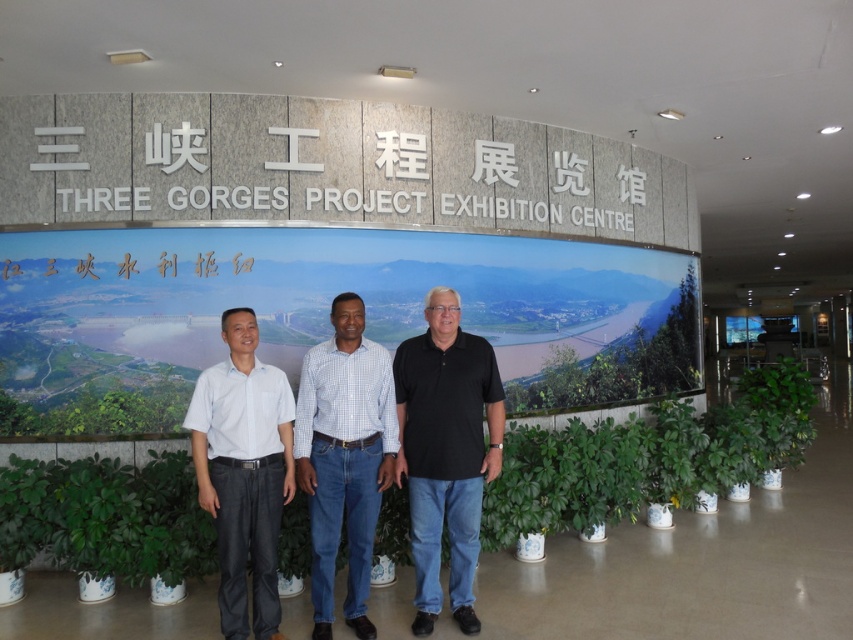
Is green leafy plant at center to the right of black cotton polo shirt at center from the viewer's perspective?

In fact, green leafy plant at center is to the left of black cotton polo shirt at center.

Is point (798, 406) positioned before point (409, 404)?

No, (798, 406) is behind (409, 404).

This screenshot has height=640, width=853. Identify the location of green leafy plant at center. (647, 458).

Can you confirm if green leafy plant at center is positioned to the left of checkered fabric shirt at center?

Indeed, green leafy plant at center is positioned on the left side of checkered fabric shirt at center.

Is green leafy plant at center below checkered fabric shirt at center?

Yes.

Between point (735, 461) and point (343, 486), which one is positioned behind?

The point (735, 461) is behind.

Locate an element on the screen. Image resolution: width=853 pixels, height=640 pixels. green leafy plant at center is located at coordinates (647, 458).

Who is positioned more to the left, black cotton polo shirt at center or dark gray cotton shirt at center?

dark gray cotton shirt at center is more to the left.

Does black cotton polo shirt at center have a greater width compared to dark gray cotton shirt at center?

Yes, black cotton polo shirt at center is wider than dark gray cotton shirt at center.

Between point (422, 436) and point (223, 451), which one is positioned behind?

The point (422, 436) is behind.

Find the location of a particular element. black cotton polo shirt at center is located at coordinates (445, 451).